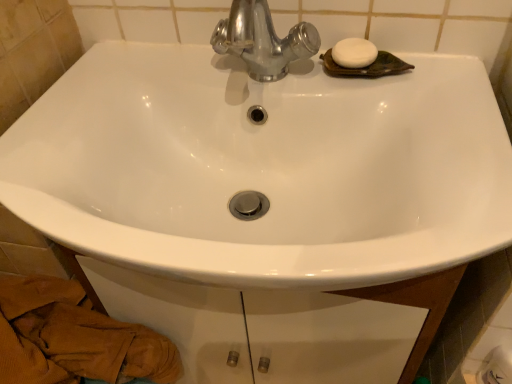
Question: Is white glossy toilet paper at lower right taller or shorter than brown textured towel at lower left?

Choices:
 (A) tall
 (B) short

Answer: (B)

Question: From a real-world perspective, is white glossy toilet paper at lower right physically located above or below brown textured towel at lower left?

Choices:
 (A) below
 (B) above

Answer: (B)

Question: Which object is positioned farthest from the white glossy toilet paper at lower right?

Choices:
 (A) brown textured towel at lower left
 (B) white matte soap at upper right

Answer: (A)

Question: Based on their relative distances, which object is nearer to the white glossy toilet paper at lower right?

Choices:
 (A) white matte soap at upper right
 (B) brown textured towel at lower left

Answer: (A)